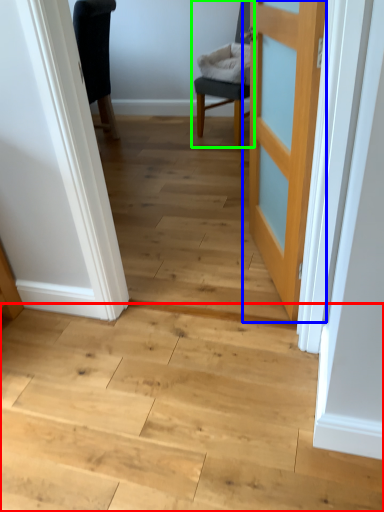
Question: Based on their relative distances, which object is nearer to stairwell (highlighted by a red box)? Choose from door (highlighted by a blue box) and chair (highlighted by a green box).

Choices:
 (A) door
 (B) chair

Answer: (A)